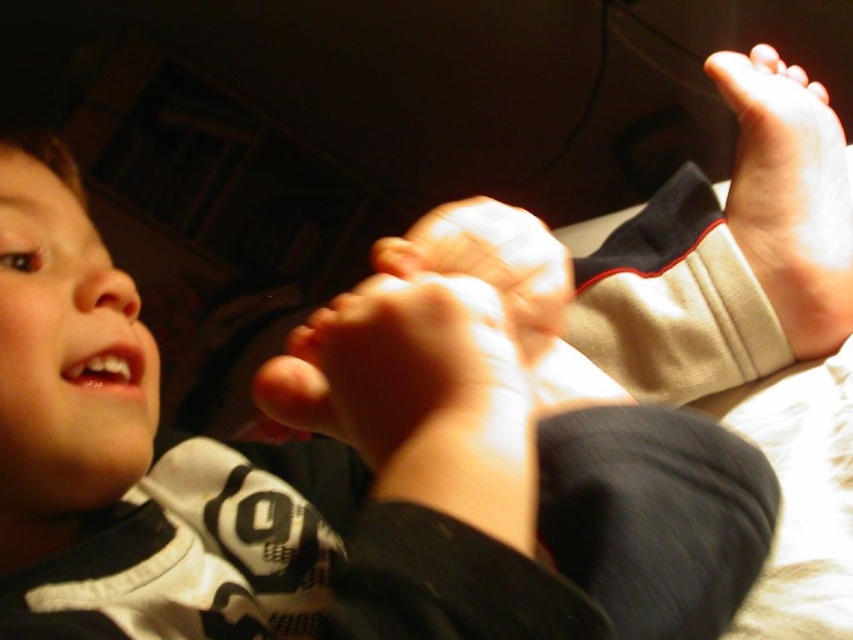
Can you confirm if smooth skin hand at center is positioned below smooth beige sock at upper right?

Yes, smooth skin hand at center is below smooth beige sock at upper right.

Describe the element at coordinates (405, 376) in the screenshot. This screenshot has width=853, height=640. I see `smooth skin hand at center` at that location.

This screenshot has width=853, height=640. Identify the location of smooth skin hand at center. (405, 376).

Does point (579, 564) come in front of point (804, 84)?

That is True.

Image resolution: width=853 pixels, height=640 pixels. Describe the element at coordinates (345, 472) in the screenshot. I see `smooth skin feet at upper center` at that location.

Locate an element on the screen. smooth skin feet at upper center is located at coordinates (345, 472).

Is smooth skin hand at center to the left of pink soft skin at upper center from the viewer's perspective?

Correct, you'll find smooth skin hand at center to the left of pink soft skin at upper center.

Measure the distance between smooth skin hand at center and pink soft skin at upper center.

A distance of 18.43 inches exists between smooth skin hand at center and pink soft skin at upper center.

Image resolution: width=853 pixels, height=640 pixels. What do you see at coordinates (405, 376) in the screenshot? I see `smooth skin hand at center` at bounding box center [405, 376].

This screenshot has width=853, height=640. In order to click on smooth skin hand at center in this screenshot , I will do `click(405, 376)`.